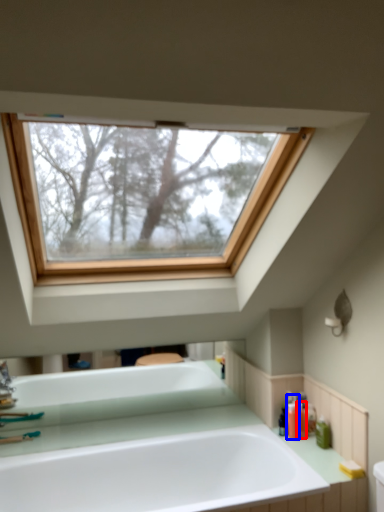
Question: Which object is closer to the camera taking this photo, toiletry (highlighted by a red box) or toiletry (highlighted by a blue box)?

Choices:
 (A) toiletry
 (B) toiletry

Answer: (B)